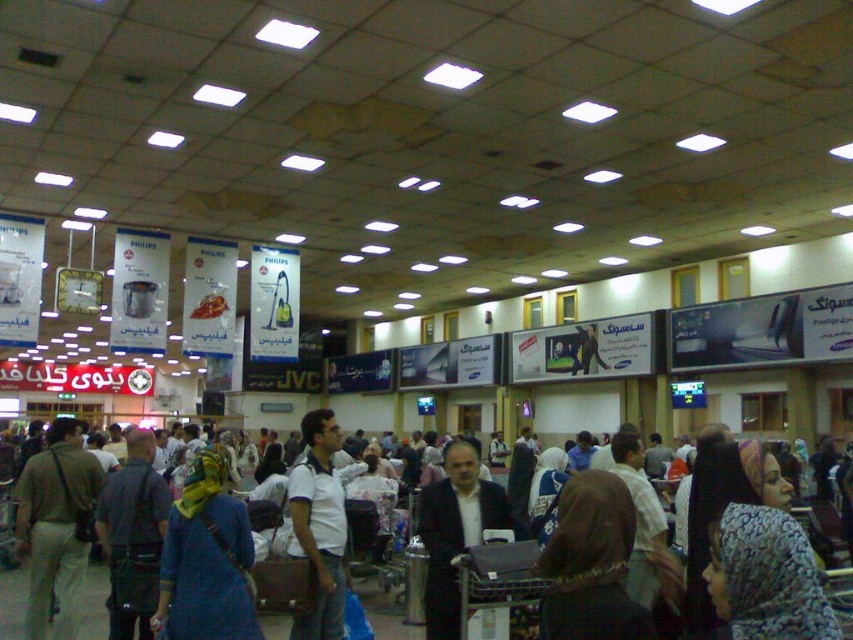
Question: Which object appears closest to the camera in this image?

Choices:
 (A) brown fabric crowd at center
 (B) light brown fabric backpack at left

Answer: (B)

Question: Where is light brown fabric backpack at left located in relation to brown fabric crowd at center in the image?

Choices:
 (A) right
 (B) left

Answer: (B)

Question: Can you confirm if blue fabric headscarf at center is positioned below light brown fabric backpack at left?

Choices:
 (A) yes
 (B) no

Answer: (B)

Question: Does blue fabric headscarf at center appear under brown fabric crowd at center?

Choices:
 (A) yes
 (B) no

Answer: (B)

Question: Which point is farther from the camera taking this photo?

Choices:
 (A) (62, 614)
 (B) (207, 445)
 (C) (15, 572)

Answer: (B)

Question: Which point is farther from the camera taking this photo?

Choices:
 (A) (65, 448)
 (B) (250, 534)
 (C) (103, 586)

Answer: (C)